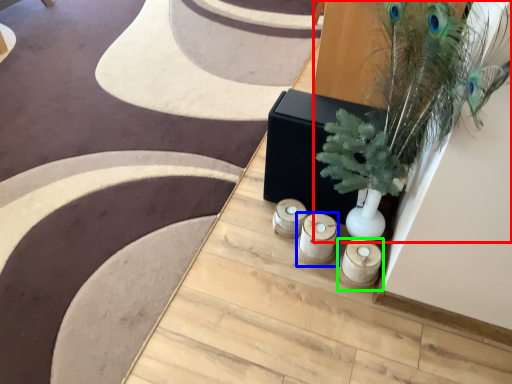
Question: Considering the real-world distances, which object is farthest from houseplant (highlighted by a red box)? candle holder (highlighted by a blue box) or candle holder (highlighted by a green box)?

Choices:
 (A) candle holder
 (B) candle holder

Answer: (B)